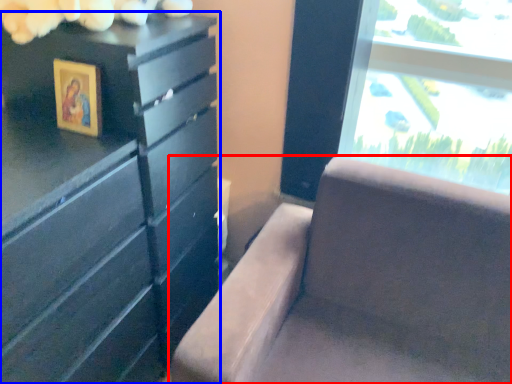
Question: Which object is closer to the camera taking this photo, furniture (highlighted by a red box) or chest of drawers (highlighted by a blue box)?

Choices:
 (A) furniture
 (B) chest of drawers

Answer: (A)